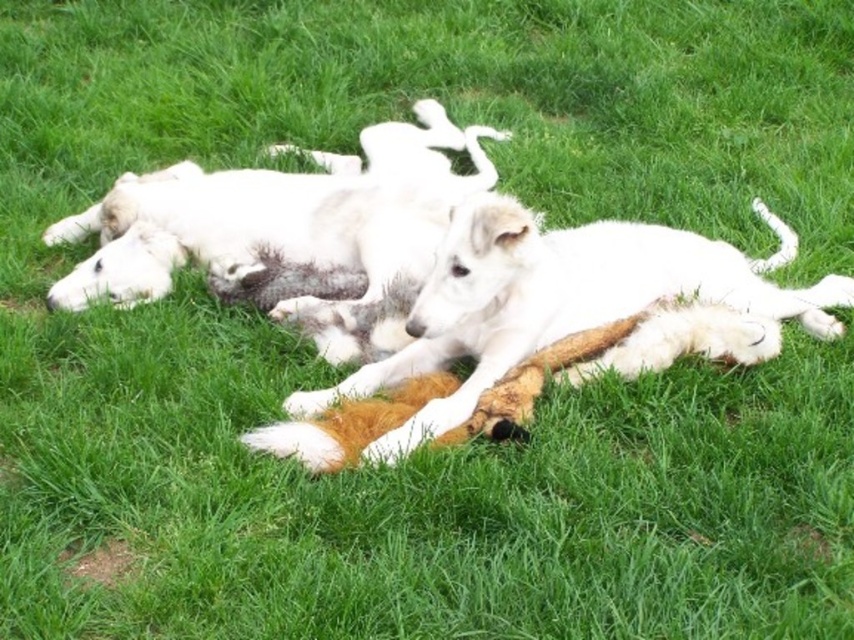
From the picture: Can you confirm if white fur dog at center is positioned below white fluffy dog at center?

Yes, white fur dog at center is below white fluffy dog at center.

Between point (823, 292) and point (250, 186), which one is positioned behind?

The point (250, 186) is more distant.

Identify the location of white fur dog at center. (556, 316).

Find the location of a particular element. The width and height of the screenshot is (854, 640). white fur dog at center is located at coordinates (556, 316).